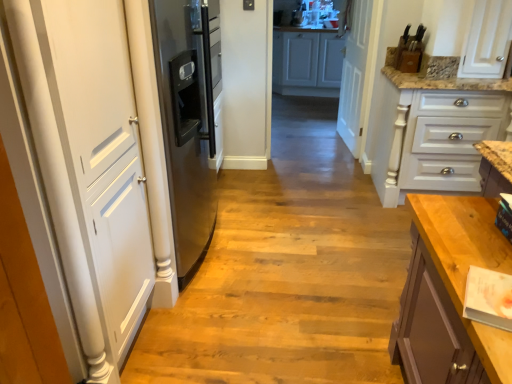
Image resolution: width=512 pixels, height=384 pixels. I want to click on free space to the left of white wood door at center, positioned as the 2th door in front-to-back order, so click(x=309, y=141).